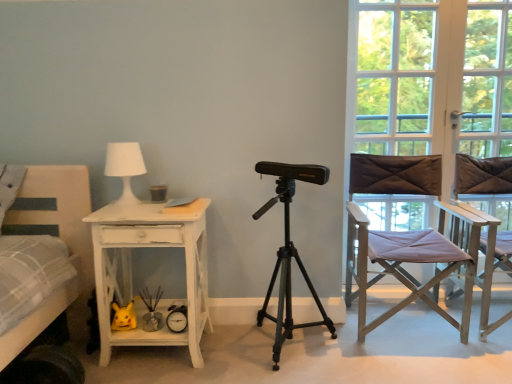
Identify the location of free space underneath metallic tripod at center (from a real-world perspective). (300, 350).